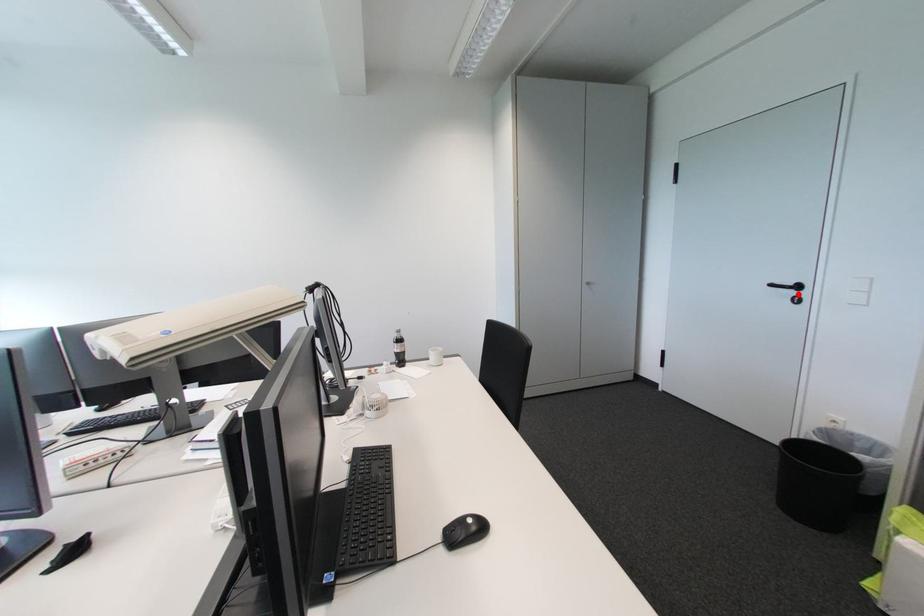
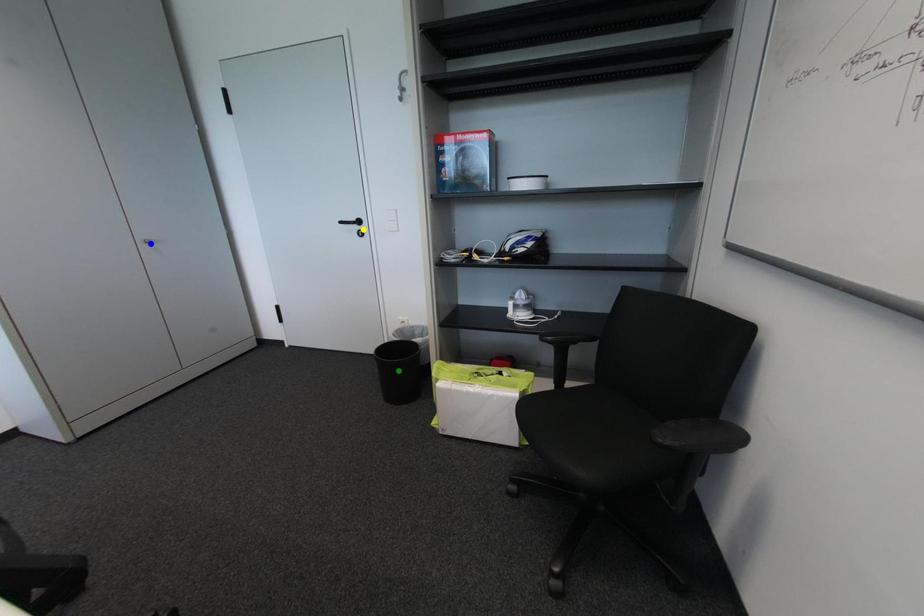
Question: I am providing you with two images of the same scene from different viewpoints. A red point is marked on the first image. You are given multiple points on the second image. In image 2, which mark is for the same physical point as the one in image 1?

Choices:
 (A) blue point
 (B) yellow point
 (C) green point

Answer: (B)